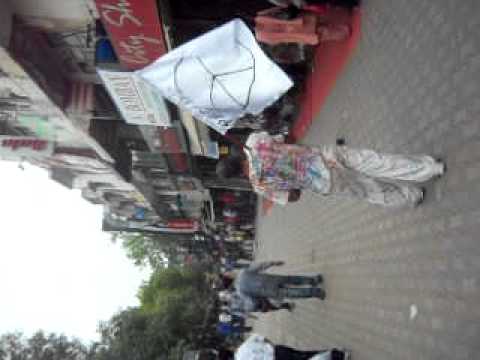
Locate an element on the screen. The image size is (480, 360). red carpet is located at coordinates (324, 70).